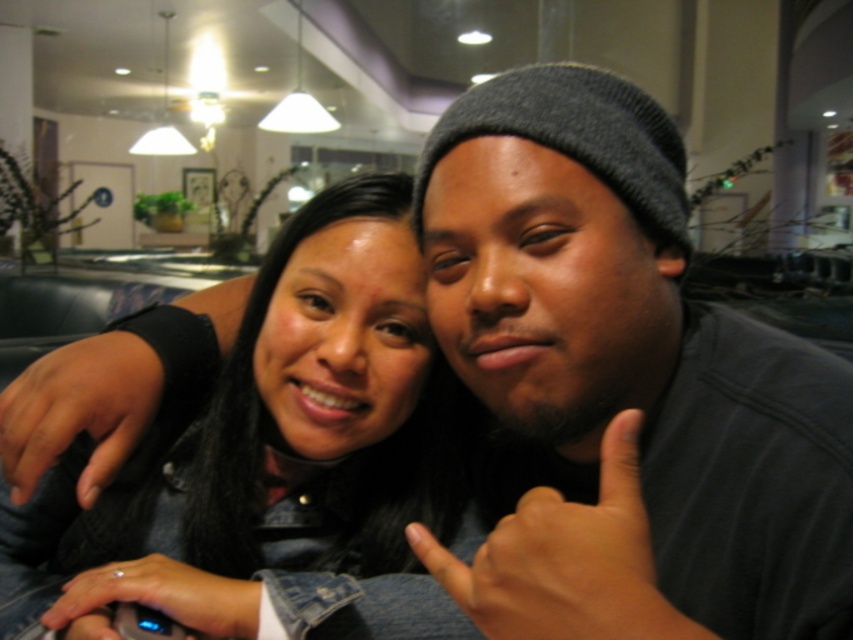
Does denim jacket at center have a greater width compared to silver metallic ring at lower left?

Yes.

You are a GUI agent. You are given a task and a screenshot of the screen. Output one action in this format:
    pyautogui.click(x=<x>, y=<y>)
    Task: Click on the denim jacket at center
    
    Given the screenshot: What is the action you would take?
    pyautogui.click(x=279, y=460)

Locate an element on the screen. This screenshot has width=853, height=640. denim jacket at center is located at coordinates (279, 460).

Does point (619, 481) come farther from viewer compared to point (132, 413)?

No, (619, 481) is in front of (132, 413).

Describe the element at coordinates (563, 557) in the screenshot. I see `dark skin tone hand at center` at that location.

I want to click on dark skin tone hand at center, so click(x=563, y=557).

Is the position of dark blue denim jacket at lower left more distant than that of silver metallic ring at lower left?

Yes, dark blue denim jacket at lower left is further from the viewer.

Which is behind, point (47, 465) or point (132, 570)?

Positioned behind is point (132, 570).

Where is `dark blue denim jacket at lower left`? This screenshot has height=640, width=853. dark blue denim jacket at lower left is located at coordinates (78, 410).